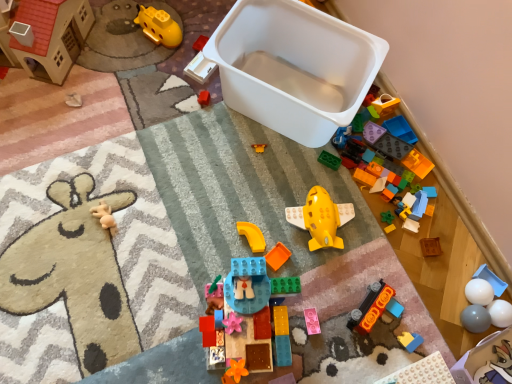
Where is `free region on the left part of white plastic tray at upper center, acting as the fourth toy starting from the left`? free region on the left part of white plastic tray at upper center, acting as the fourth toy starting from the left is located at coordinates [152, 68].